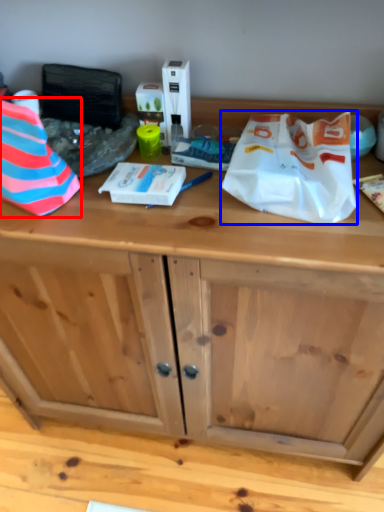
Question: Among these objects, which one is farthest to the camera, wrapping paper (highlighted by a red box) or wrapping paper (highlighted by a blue box)?

Choices:
 (A) wrapping paper
 (B) wrapping paper

Answer: (B)